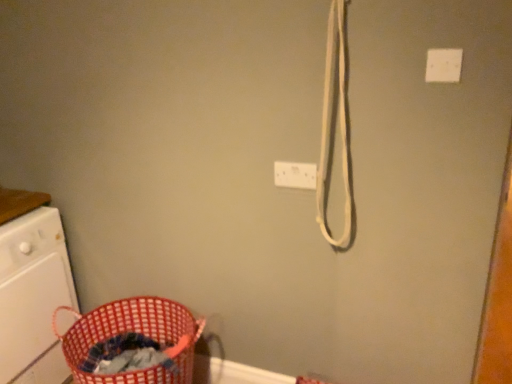
In order to face red woven laundry basket at lower left, should I rotate leftwards or rightwards?

A 15.756 degree turn to the left will do.

Image resolution: width=512 pixels, height=384 pixels. Find the location of `red woven laundry basket at lower left`. red woven laundry basket at lower left is located at coordinates (133, 331).

Which is more to the left, white plastic washing machine at left or red woven laundry basket at lower left?

Positioned to the left is white plastic washing machine at left.

Which object is further away from the camera taking this photo, white plastic washing machine at left or red woven laundry basket at lower left?

white plastic washing machine at left is behind.

Is white plastic washing machine at left surrounding red woven laundry basket at lower left?

No, red woven laundry basket at lower left is not surrounded by white plastic washing machine at left.

From a real-world perspective, is white plastic washing machine at left positioned under red woven laundry basket at lower left based on gravity?

No, from a real-world perspective, white plastic washing machine at left is not below red woven laundry basket at lower left.

Consider the image. In terms of width, does white plastic electric outlet at upper center look wider or thinner when compared to white plastic washing machine at left?

Clearly, white plastic electric outlet at upper center has less width compared to white plastic washing machine at left.

Consider the image. Considering the relative sizes of white plastic electric outlet at upper center and white plastic washing machine at left in the image provided, is white plastic electric outlet at upper center bigger than white plastic washing machine at left?

No, white plastic electric outlet at upper center is not bigger than white plastic washing machine at left.

Could you tell me if white plastic electric outlet at upper center is turned towards white plastic washing machine at left?

No, white plastic electric outlet at upper center is not aimed at white plastic washing machine at left.

Where is `home appliance that appears below the white plastic electric outlet at upper center (from the image's perspective)`? home appliance that appears below the white plastic electric outlet at upper center (from the image's perspective) is located at coordinates (33, 297).

From a real-world perspective, who is located higher, white plastic electric outlet at upper center or red woven laundry basket at lower left?

white plastic electric outlet at upper center.

Image resolution: width=512 pixels, height=384 pixels. Identify the location of basket beneath the white plastic electric outlet at upper center (from a real-world perspective). (133, 331).

Which of these two, white plastic electric outlet at upper center or red woven laundry basket at lower left, is wider?

red woven laundry basket at lower left.

Measure the distance from white plastic electric outlet at upper center to red woven laundry basket at lower left.

The distance of white plastic electric outlet at upper center from red woven laundry basket at lower left is 33.73 inches.

Considering the sizes of objects white plastic electric outlet at upper center and white plastic light switch at upper right in the image provided, who is wider, white plastic electric outlet at upper center or white plastic light switch at upper right?

With larger width is white plastic electric outlet at upper center.

From the image's perspective, who appears lower, white plastic electric outlet at upper center or white plastic light switch at upper right?

white plastic electric outlet at upper center appears lower in the image.

Where is `electric outlet on the left of white plastic light switch at upper right`? electric outlet on the left of white plastic light switch at upper right is located at coordinates [295, 175].

From a real-world perspective, is white plastic electric outlet at upper center physically located above or below white plastic light switch at upper right?

In terms of real-world spatial position, white plastic electric outlet at upper center is below white plastic light switch at upper right.

Is red woven laundry basket at lower left taller than white plastic washing machine at left?

No, red woven laundry basket at lower left is not taller than white plastic washing machine at left.

From a real-world perspective, relative to white plastic washing machine at left, is red woven laundry basket at lower left vertically above or below?

In terms of real-world spatial position, red woven laundry basket at lower left is below white plastic washing machine at left.

How different are the orientations of red woven laundry basket at lower left and white plastic washing machine at left in degrees?

92.6 degrees separate the facing orientations of red woven laundry basket at lower left and white plastic washing machine at left.

Identify the location of basket in front of the white plastic washing machine at left. The width and height of the screenshot is (512, 384). (133, 331).

Does white plastic light switch at upper right have a lesser width compared to white plastic washing machine at left?

Indeed, white plastic light switch at upper right has a lesser width compared to white plastic washing machine at left.

Measure the distance from white plastic light switch at upper right to white plastic washing machine at left.

white plastic light switch at upper right is 1.66 meters away from white plastic washing machine at left.

Does white plastic light switch at upper right have a lesser height compared to white plastic washing machine at left?

Indeed, white plastic light switch at upper right has a lesser height compared to white plastic washing machine at left.

Is white plastic light switch at upper right aimed at white plastic washing machine at left?

A: No, white plastic light switch at upper right is not aimed at white plastic washing machine at left.

Can you confirm if white plastic light switch at upper right is taller than white plastic electric outlet at upper center?

No.

Considering the relative sizes of white plastic light switch at upper right and white plastic electric outlet at upper center in the image provided, is white plastic light switch at upper right bigger than white plastic electric outlet at upper center?

Actually, white plastic light switch at upper right might be smaller than white plastic electric outlet at upper center.

Considering the relative sizes of white plastic light switch at upper right and white plastic electric outlet at upper center in the image provided, is white plastic light switch at upper right thinner than white plastic electric outlet at upper center?

Indeed, white plastic light switch at upper right has a lesser width compared to white plastic electric outlet at upper center.

Locate an element on the screen. The image size is (512, 384). electric outlet located on the left of white plastic light switch at upper right is located at coordinates (295, 175).

Locate an element on the screen. Image resolution: width=512 pixels, height=384 pixels. home appliance positioned vertically above the red woven laundry basket at lower left (from a real-world perspective) is located at coordinates (33, 297).

Identify the location of electric outlet on the right of the white plastic washing machine at left. (295, 175).

Considering their positions, is red woven laundry basket at lower left positioned closer to white plastic electric outlet at upper center than white plastic washing machine at left?

red woven laundry basket at lower left.

Which object lies further to the anchor point red woven laundry basket at lower left, white plastic light switch at upper right or white plastic electric outlet at upper center?

Among the two, white plastic light switch at upper right is located further to red woven laundry basket at lower left.

Estimate the real-world distances between objects in this image. Which object is further from white plastic electric outlet at upper center, white plastic washing machine at left or red woven laundry basket at lower left?

The object further to white plastic electric outlet at upper center is white plastic washing machine at left.

When comparing their distances from red woven laundry basket at lower left, does white plastic light switch at upper right or white plastic washing machine at left seem closer?

Based on the image, white plastic washing machine at left appears to be nearer to red woven laundry basket at lower left.

Considering their positions, is red woven laundry basket at lower left positioned closer to white plastic electric outlet at upper center than white plastic light switch at upper right?

The object closer to white plastic electric outlet at upper center is white plastic light switch at upper right.

Which object lies nearer to the anchor point white plastic light switch at upper right, white plastic washing machine at left or white plastic electric outlet at upper center?

The object closer to white plastic light switch at upper right is white plastic electric outlet at upper center.

Looking at this image, looking at the image, which one is located closer to white plastic light switch at upper right, red woven laundry basket at lower left or white plastic washing machine at left?

Among the two, red woven laundry basket at lower left is located nearer to white plastic light switch at upper right.

When comparing their distances from white plastic light switch at upper right, does red woven laundry basket at lower left or white plastic electric outlet at upper center seem closer?

white plastic electric outlet at upper center is closer to white plastic light switch at upper right.

The width and height of the screenshot is (512, 384). I want to click on electric outlet between white plastic washing machine at left and white plastic light switch at upper right from left to right, so click(x=295, y=175).

At what (x,y) coordinates should I click in order to perform the action: click on electric outlet between white plastic light switch at upper right and red woven laundry basket at lower left in the up-down direction. Please return your answer as a coordinate pair (x, y). Looking at the image, I should click on (295, 175).

This screenshot has width=512, height=384. Identify the location of basket located between white plastic washing machine at left and white plastic electric outlet at upper center in the left-right direction. (133, 331).

At what (x,y) coordinates should I click in order to perform the action: click on basket located between white plastic washing machine at left and white plastic light switch at upper right in the left-right direction. Please return your answer as a coordinate pair (x, y). The image size is (512, 384). Looking at the image, I should click on (133, 331).